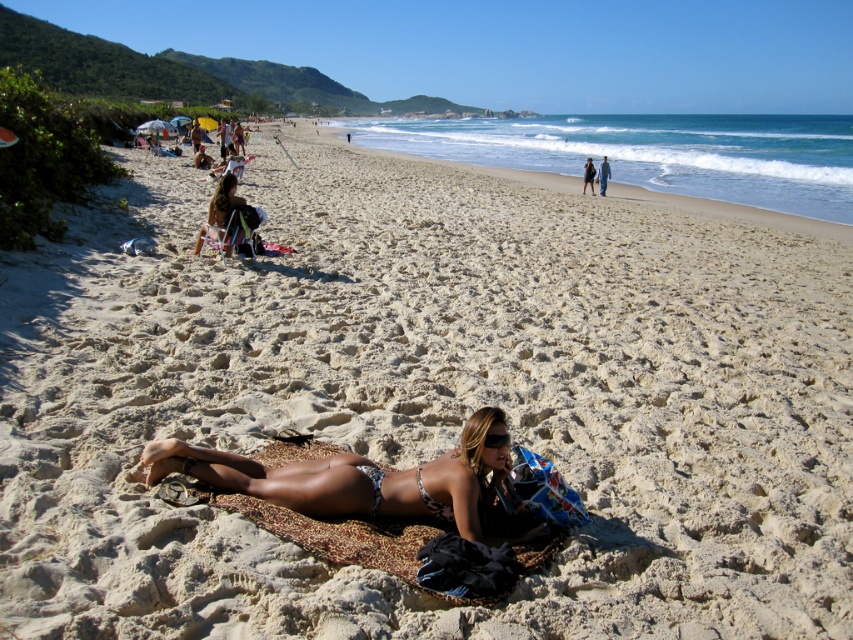
Question: Is printed bikini at center thinner than blue denim jeans at center?

Choices:
 (A) yes
 (B) no

Answer: (B)

Question: Estimate the real-world distances between objects in this image. Which object is closer to the blue denim jeans at center?

Choices:
 (A) leopard print fabric at center
 (B) dark blue fabric bag at center
 (C) printed bikini at center

Answer: (B)

Question: Which object is farther from the camera taking this photo?

Choices:
 (A) printed bikini at center
 (B) dark blue fabric bag at center
 (C) leopard print fabric at center

Answer: (B)

Question: Among these points, which one is nearest to the camera?

Choices:
 (A) (320, 540)
 (B) (415, 468)

Answer: (A)

Question: Is printed bikini at center in front of dark blue fabric bag at center?

Choices:
 (A) yes
 (B) no

Answer: (A)

Question: Observing the image, what is the correct spatial positioning of printed bikini at center in reference to dark blue fabric bag at center?

Choices:
 (A) above
 (B) below

Answer: (B)